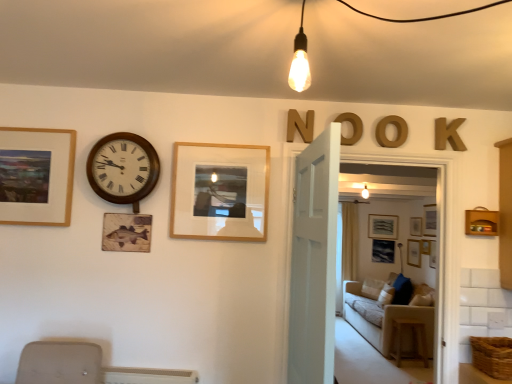
Locate an element on the screen. The image size is (512, 384). matte black picture frame at center, which is the first picture frame in bottom-to-top order is located at coordinates [x=383, y=251].

Consider the image. Measure the distance between gold metallic letter o at upper center, the second letter in the right-to-left sequence, and camera.

The depth of gold metallic letter o at upper center, the second letter in the right-to-left sequence, is 7.63 feet.

Measure the distance between wooden letter n at upper center, the fourth letter from the right, and camera.

7.56 feet.

Where is `brown woven basket at lower right`? This screenshot has width=512, height=384. brown woven basket at lower right is located at coordinates (493, 356).

Which picture frame is the 2nd one when counting from the right side of the brown woven basket at lower right? Please provide its 2D coordinates.

[(382, 226)]

Between brown woven basket at lower right and matte gray picture frame at center, which ranks as the 1th picture frame in back-to-front order, which one appears on the left side from the viewer's perspective?

Positioned to the left is brown woven basket at lower right.

Who is smaller, brown woven basket at lower right or matte gray picture frame at center, the third picture frame when ordered from top to bottom?

Smaller between the two is brown woven basket at lower right.

Which object is more forward, brown woven basket at lower right or matte gray picture frame at center, the first picture frame positioned from the right?

Positioned in front is brown woven basket at lower right.

Does matte wooden picture frame at left, the fourth picture frame in the right-to-left sequence, lie in front of wooden at right?

That is True.

Locate an element on the screen. the 2nd picture frame counting from the left side of the wooden at right is located at coordinates (36, 176).

Considering the relative sizes of matte wooden picture frame at left, the 1th picture frame viewed from the top, and wooden at right in the image provided, is matte wooden picture frame at left, the 1th picture frame viewed from the top, shorter than wooden at right?

Incorrect, the height of matte wooden picture frame at left, the 1th picture frame viewed from the top, does not fall short of that of wooden at right.

How distant is wooden at right from gold metallic letter at upper center, the second letter viewed from the left?

wooden at right is 2.84 meters away from gold metallic letter at upper center, the second letter viewed from the left.

Considering the relative sizes of wooden at right and gold metallic letter at upper center, the second letter viewed from the left, in the image provided, is wooden at right wider than gold metallic letter at upper center, the second letter viewed from the left,?

Indeed, wooden at right has a greater width compared to gold metallic letter at upper center, the second letter viewed from the left.

Is wooden at right bigger or smaller than gold metallic letter at upper center, which appears as the third letter when viewed from the right?

Considering their sizes, wooden at right takes up more space than gold metallic letter at upper center, which appears as the third letter when viewed from the right.

From the image's perspective, is transparent glass door at center beneath beige fabric couch at center?

No.

Where is `glass door that appears above the beige fabric couch at center (from the image's perspective)`? glass door that appears above the beige fabric couch at center (from the image's perspective) is located at coordinates (439, 248).

Considering the relative positions of transparent glass door at center and beige fabric couch at center in the image provided, is transparent glass door at center in front of beige fabric couch at center?

Yes, it is in front of beige fabric couch at center.

Between transparent glass door at center and beige fabric couch at center, which one has less height?

beige fabric couch at center.

From a real-world perspective, is matte wooden picture frame at left, marked as the 4th picture frame in a bottom-to-top arrangement, above or below gold metallic letter at upper center, the second letter viewed from the left?

From a real-world perspective, matte wooden picture frame at left, marked as the 4th picture frame in a bottom-to-top arrangement, is physically below gold metallic letter at upper center, the second letter viewed from the left.

Considering the sizes of objects matte wooden picture frame at left, which ranks as the 1th picture frame in front-to-back order, and gold metallic letter at upper center, which appears as the third letter when viewed from the right, in the image provided, who is thinner, matte wooden picture frame at left, which ranks as the 1th picture frame in front-to-back order, or gold metallic letter at upper center, which appears as the third letter when viewed from the right,?

Thinner between the two is matte wooden picture frame at left, which ranks as the 1th picture frame in front-to-back order.

Does point (49, 223) come farther from viewer compared to point (335, 119)?

No, it is in front of (335, 119).

Is matte wooden picture frame at left, marked as the 4th picture frame in a bottom-to-top arrangement, next to gold metallic letter at upper center, which appears as the third letter when viewed from the right?

matte wooden picture frame at left, marked as the 4th picture frame in a bottom-to-top arrangement, is not next to gold metallic letter at upper center, which appears as the third letter when viewed from the right, and they're not touching.

Is gold metallic letter at upper center, which appears as the third letter when viewed from the right, outside of brown woven basket at lower right?

Yes, gold metallic letter at upper center, which appears as the third letter when viewed from the right, is outside of brown woven basket at lower right.

Considering the relative sizes of gold metallic letter at upper center, which appears as the third letter when viewed from the right, and brown woven basket at lower right in the image provided, is gold metallic letter at upper center, which appears as the third letter when viewed from the right, wider than brown woven basket at lower right?

Incorrect, the width of gold metallic letter at upper center, which appears as the third letter when viewed from the right, does not surpass that of brown woven basket at lower right.

From their relative heights in the image, would you say gold metallic letter at upper center, which appears as the third letter when viewed from the right, is taller or shorter than brown woven basket at lower right?

Considering their sizes, gold metallic letter at upper center, which appears as the third letter when viewed from the right, has more height than brown woven basket at lower right.

Is gold metallic letter at upper center, the second letter viewed from the left, oriented away from brown woven basket at lower right?

A: No, gold metallic letter at upper center, the second letter viewed from the left, is not facing away from brown woven basket at lower right.

Is matte black picture frame at center, the second picture frame positioned from the right, turned away from white wooden door at center?

No.

From the picture: Which of these two, matte black picture frame at center, the third picture frame in the left-to-right sequence, or white wooden door at center, is bigger?

With larger size is white wooden door at center.

From the picture: How many degrees apart are the facing directions of matte black picture frame at center, the second picture frame positioned from the right, and white wooden door at center?

matte black picture frame at center, the second picture frame positioned from the right, and white wooden door at center are facing 95.4 degrees away from each other.

Considering the sizes of objects matte black picture frame at center, the 3th picture frame viewed from the front, and white wooden door at center in the image provided, who is taller, matte black picture frame at center, the 3th picture frame viewed from the front, or white wooden door at center?

Standing taller between the two is white wooden door at center.

There is a brown woven basket at lower right. Identify the location of the 1st picture frame above it (from the image's perspective). (382, 226).

Identify the location of the 4th picture frame directly above the wooden at right (from a real-world perspective). The height and width of the screenshot is (384, 512). (36, 176).

Which object lies nearer to the anchor point white wooden door at center, beige fabric couch at center or brown woven basket at lower right?

The object closer to white wooden door at center is brown woven basket at lower right.

Considering their positions, is woodenwall clock at left positioned further to wooden at right than brown woven basket at lower right?

Based on the image, woodenwall clock at left appears to be further to wooden at right.

Which object lies nearer to the anchor point brown woven basket at lower right, wooden letter n at upper center, the fourth letter from the right, or matte black picture frame at center, the 3th picture frame viewed from the front?

wooden letter n at upper center, the fourth letter from the right, is closer to brown woven basket at lower right.

Estimate the real-world distances between objects in this image. Which object is closer to beige fabric couch at center, wooden frame at center, which is the 2th picture frame from front to back, or matte gray picture frame at center, which ranks as the 1th picture frame in back-to-front order?

matte gray picture frame at center, which ranks as the 1th picture frame in back-to-front order, lies closer to beige fabric couch at center than the other object.

Considering their positions, is matte gray picture frame at center, which is counted as the 4th picture frame, starting from the left, positioned closer to matte black picture frame at center, the 3th picture frame viewed from the front, than matte wooden picture frame at left, which ranks as the 1th picture frame in front-to-back order?

matte gray picture frame at center, which is counted as the 4th picture frame, starting from the left, is closer to matte black picture frame at center, the 3th picture frame viewed from the front.

Consider the image. Looking at the image, which one is located further to transparent glass door at center, gold metallic letter o at upper center, the second letter in the right-to-left sequence, or matte black picture frame at center, the second picture frame positioned from the right?

The object further to transparent glass door at center is matte black picture frame at center, the second picture frame positioned from the right.

When comparing their distances from woodenwall clock at left, does gold metallic letter o at upper center, the second letter in the right-to-left sequence, or beige fabric couch at center seem further?

beige fabric couch at center lies further to woodenwall clock at left than the other object.

Which object lies nearer to the anchor point brown woven basket at lower right, matte gray picture frame at center, the third picture frame when ordered from top to bottom, or matte black picture frame at center, which ranks as the 4th picture frame in top-to-bottom order?

The object closer to brown woven basket at lower right is matte black picture frame at center, which ranks as the 4th picture frame in top-to-bottom order.

Image resolution: width=512 pixels, height=384 pixels. I want to click on glass door located between brown woven basket at lower right and matte gray picture frame at center, the first picture frame positioned from the right, in the depth direction, so click(439, 248).

At what (x,y) coordinates should I click in order to perform the action: click on wall clock between brown woven basket at lower right and matte gray picture frame at center, the first picture frame positioned from the right, in the front-back direction. Please return your answer as a coordinate pair (x, y). Looking at the image, I should click on (123, 168).

You are a GUI agent. You are given a task and a screenshot of the screen. Output one action in this format:
    pyautogui.click(x=<x>, y=<y>)
    Task: Click on the door between matte wooden picture frame at left, the 1th picture frame viewed from the top, and wooden letter n at upper center, the fourth letter from the right, from left to right
    This screenshot has height=384, width=512.
    Given the screenshot: What is the action you would take?
    pyautogui.click(x=314, y=261)

Image resolution: width=512 pixels, height=384 pixels. I want to click on picture frame between matte wooden picture frame at left, the fourth picture frame in the right-to-left sequence, and matte black picture frame at center, the 3th picture frame viewed from the front, from front to back, so click(x=219, y=191).